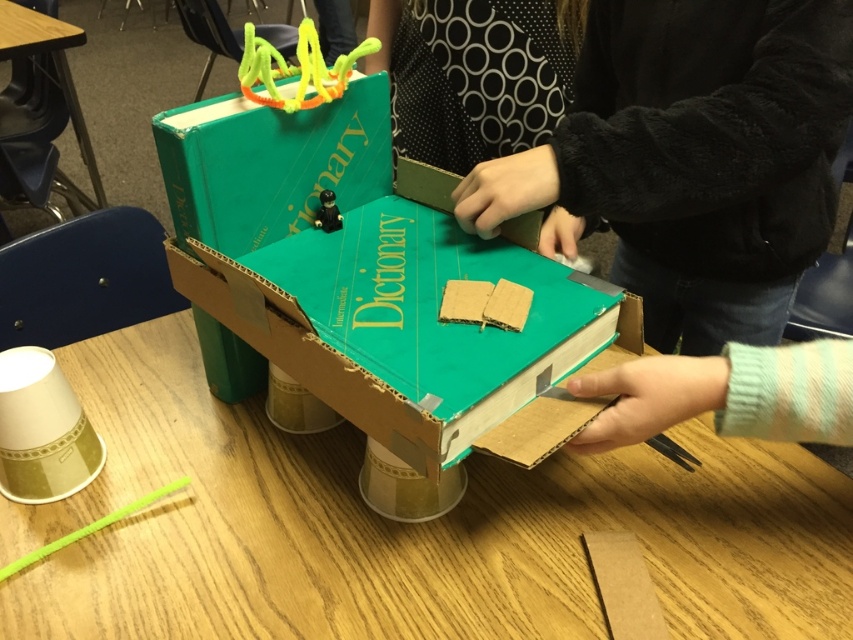
Which is more to the left, black dotted fabric at upper center or wooden table at lower left?

Positioned to the left is wooden table at lower left.

This screenshot has height=640, width=853. I want to click on black dotted fabric at upper center, so click(474, 74).

Image resolution: width=853 pixels, height=640 pixels. What are the coordinates of `black dotted fabric at upper center` in the screenshot? It's located at pos(474,74).

Between point (311, 602) and point (329, 189), which one is positioned behind?

Point (329, 189)

Based on the photo, which is more to the right, green cardboard box at center or green plastic toy at center?

Positioned to the right is green cardboard box at center.

This screenshot has width=853, height=640. Describe the element at coordinates (404, 529) in the screenshot. I see `green cardboard box at center` at that location.

Image resolution: width=853 pixels, height=640 pixels. In order to click on green cardboard box at center in this screenshot , I will do `click(404, 529)`.

Does green cardboard box at center have a greater width compared to cardboard at center?

Indeed, green cardboard box at center has a greater width compared to cardboard at center.

Who is taller, green cardboard box at center or cardboard at center?

With more height is green cardboard box at center.

At what (x,y) coordinates should I click in order to perform the action: click on green cardboard box at center. Please return your answer as a coordinate pair (x, y). The image size is (853, 640). Looking at the image, I should click on (404, 529).